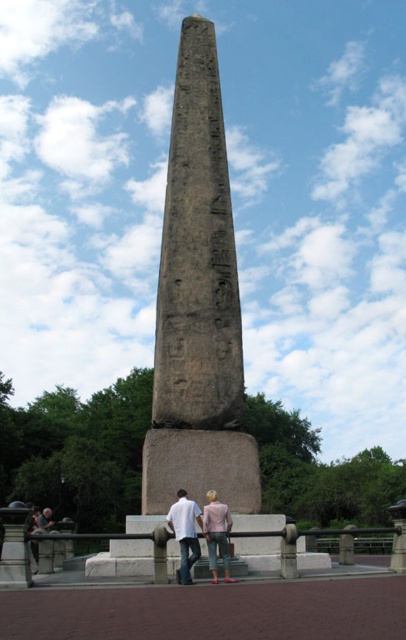
You are an archaeologist examining the granite obelisk at center and the pink fabric pants at lower center. Which object is bigger in size?

The granite obelisk at center is larger in size compared to the pink fabric pants at lower center.

You are standing at the center of the paved area and want to take a photo of the obelisk. There is a person wearing a white cotton shirt at center in your way. Where should you move to avoid blocking the view of the obelisk?

Move to the left or right of the white cotton shirt at center to avoid blocking the view of the obelisk.